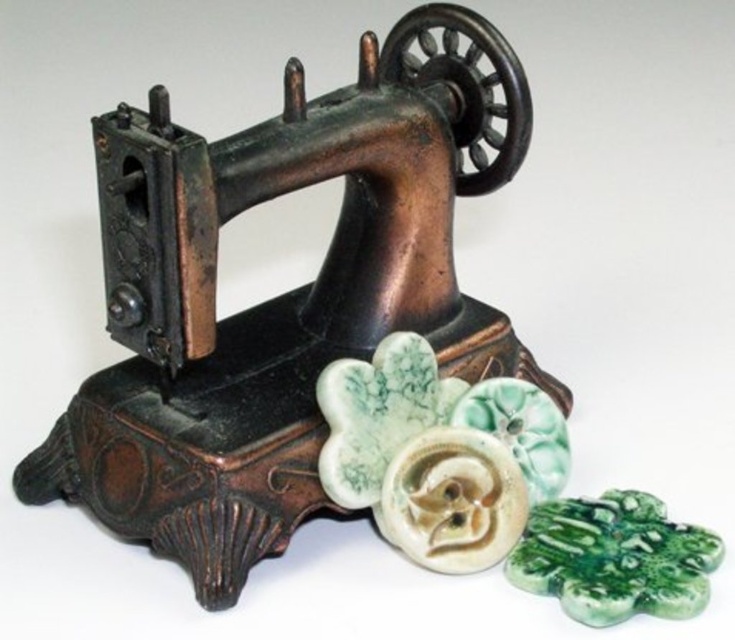
You are a collector of vintage buttons and have a display case that can only accommodate buttons smaller than 3 centimeters in diameter. You see the green glazed clover at center and the green glazed ceramic flower at center. Which of these buttons can fit into your display case?

The green glazed ceramic flower at center can fit into the display case since it is smaller in size than the green glazed clover at center, which is larger and may exceed the 3 cm diameter limit.

From the picture: You are a collector of vintage items and see the green marble flower at center and the green glazed ceramic flower at center. Which one is closer to you?

The green marble flower at center is closer to you because it is in front of the green glazed ceramic flower at center.